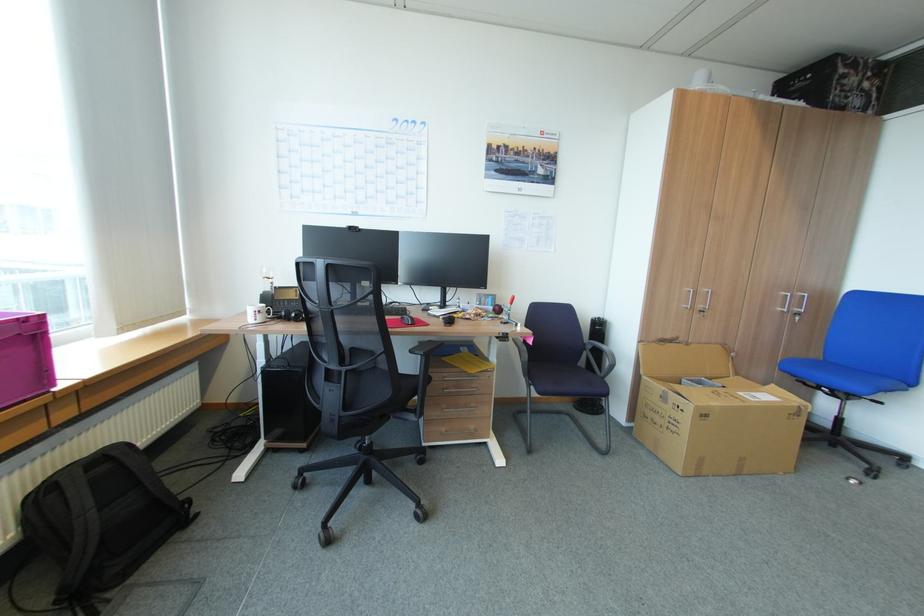
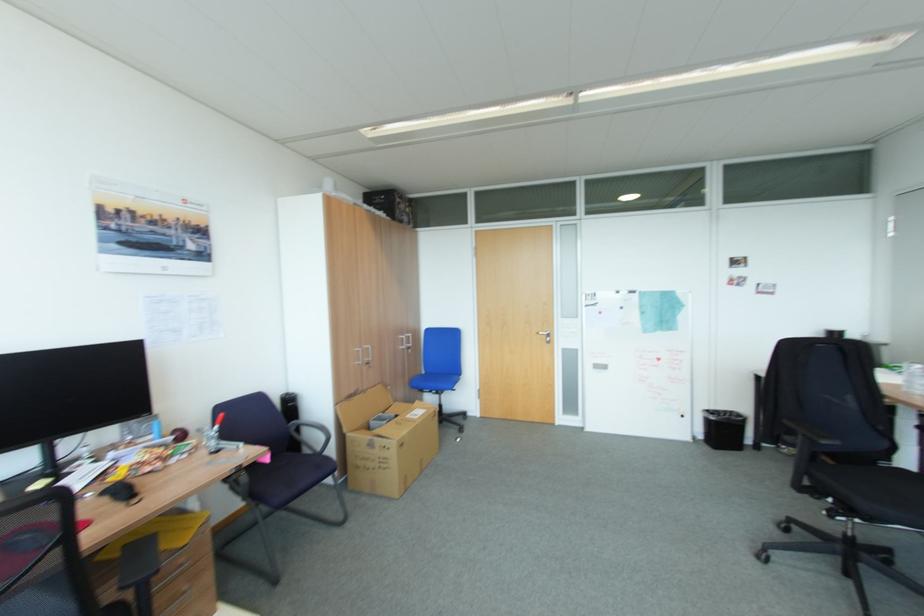
Find the pixel in the second image that matches pixel 771 384 in the first image.

(419, 403)